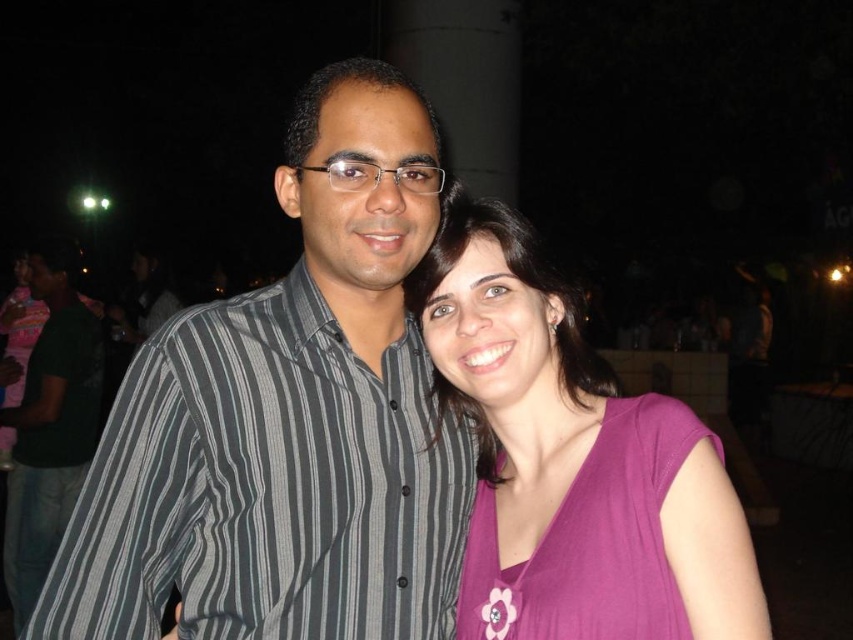
You are a photographer trying to focus on the purple matte shirt at center. You notice a point at coordinates (572, 461) in the image. Is this point located on the purple matte shirt at center?

Yes, the point (572, 461) is located on the purple matte shirt at center according to the description.

You are standing at the point with coordinates point (706,484) and want to move towards the point with coordinates point (492,536). Which direction should you move to reach your destination?

You should move backward because point (706,484) is in front of point (492,536).

You are a photographer trying to focus on the striped shirt at center. You notice a bright light source in the upper left corner. Will the point you are focusing on, point (288, 420), be on the striped shirt at center or somewhere else?

The point (288, 420) is on the striped shirt at center, so the focus will be correctly placed on the striped shirt at center.